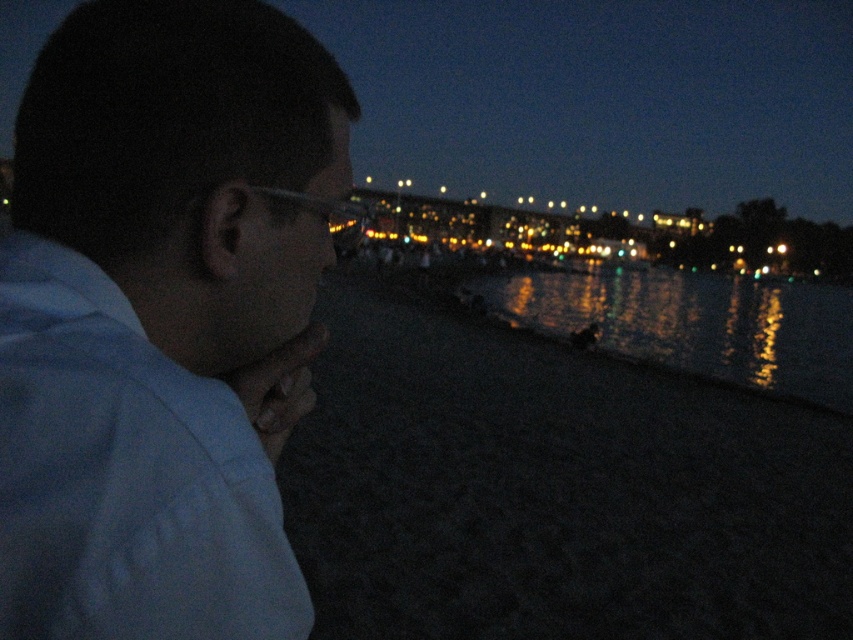
Question: Which object is closer to the camera taking this photo?

Choices:
 (A) glistening reflective water at lower center
 (B) white matte shirt at left

Answer: (B)

Question: Which point is farther to the camera?

Choices:
 (A) glistening reflective water at lower center
 (B) white matte shirt at left

Answer: (A)

Question: Where is white matte shirt at left located in relation to glistening reflective water at lower center in the image?

Choices:
 (A) left
 (B) right

Answer: (A)

Question: Does white matte shirt at left have a greater width compared to glistening reflective water at lower center?

Choices:
 (A) yes
 (B) no

Answer: (B)

Question: Is white matte shirt at left further to camera compared to glistening reflective water at lower center?

Choices:
 (A) no
 (B) yes

Answer: (A)

Question: Among these points, which one is farthest from the camera?

Choices:
 (A) (664, 269)
 (B) (196, 250)

Answer: (A)